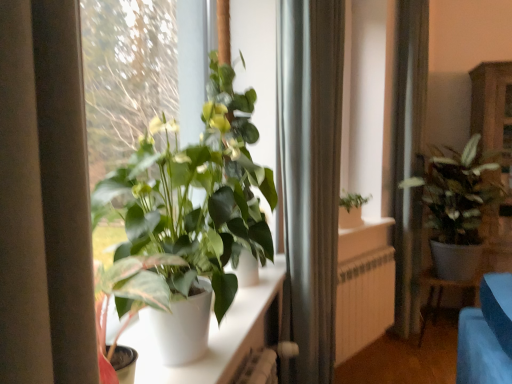
Where is `textured green plant at right, which is counted as the second houseplant, starting from the front`? This screenshot has height=384, width=512. textured green plant at right, which is counted as the second houseplant, starting from the front is located at coordinates (458, 205).

Where is `dresser above the white glossy plant at center (from a real-world perspective)`? Image resolution: width=512 pixels, height=384 pixels. dresser above the white glossy plant at center (from a real-world perspective) is located at coordinates (492, 104).

Is point (471, 109) farther from viewer compared to point (223, 368)?

Yes, point (471, 109) is farther from viewer.

From a real-world perspective, between wooden cabinet at right and white glossy plant at center, who is vertically higher?

wooden cabinet at right, from a real-world perspective.

Is silky white curtain at center, the second curtain positioned from the right, not close to silky white curtain at right, marked as the second curtain in a front-to-back arrangement?

Yes.

Considering the relative sizes of silky white curtain at center, the 1th curtain from the left, and silky white curtain at right, which appears as the 1th curtain when viewed from the right, in the image provided, is silky white curtain at center, the 1th curtain from the left, smaller than silky white curtain at right, which appears as the 1th curtain when viewed from the right,?

Yes, silky white curtain at center, the 1th curtain from the left, is smaller than silky white curtain at right, which appears as the 1th curtain when viewed from the right.

Could you tell me if silky white curtain at center, marked as the 2th curtain in a back-to-front arrangement, is facing silky white curtain at right, marked as the first curtain in a back-to-front arrangement?

No, silky white curtain at center, marked as the 2th curtain in a back-to-front arrangement, is not aimed at silky white curtain at right, marked as the first curtain in a back-to-front arrangement.

The height and width of the screenshot is (384, 512). Find the location of `curtain located below the silky white curtain at right, which appears as the 1th curtain when viewed from the right (from the image's perspective)`. curtain located below the silky white curtain at right, which appears as the 1th curtain when viewed from the right (from the image's perspective) is located at coordinates (310, 178).

Does white glossy plant at center touch silky white curtain at center, the 1th curtain from the left?

white glossy plant at center and silky white curtain at center, the 1th curtain from the left, are clearly separated.

Is white glossy plant at center behind silky white curtain at center, marked as the 2th curtain in a back-to-front arrangement?

No.

Considering the sizes of objects white glossy plant at center and silky white curtain at center, marked as the 2th curtain in a back-to-front arrangement, in the image provided, who is wider, white glossy plant at center or silky white curtain at center, marked as the 2th curtain in a back-to-front arrangement,?

With larger width is silky white curtain at center, marked as the 2th curtain in a back-to-front arrangement.

Which object is positioned more to the left, silky white curtain at center, which appears as the 1th curtain when viewed from the front, or white matte radiator at center?

silky white curtain at center, which appears as the 1th curtain when viewed from the front, is more to the left.

From the image's perspective, is silky white curtain at center, marked as the 2th curtain in a back-to-front arrangement, above or below white matte radiator at center?

silky white curtain at center, marked as the 2th curtain in a back-to-front arrangement, is above white matte radiator at center.

I want to click on curtain in front of the white matte radiator at center, so click(x=310, y=178).

Can you confirm if silky white curtain at center, which appears as the 1th curtain when viewed from the front, is smaller than white matte radiator at center?

No, silky white curtain at center, which appears as the 1th curtain when viewed from the front, is not smaller than white matte radiator at center.

From the image's perspective, is white glossy plant at center above or below silky white curtain at right, the 2th curtain from the left?

white glossy plant at center is below silky white curtain at right, the 2th curtain from the left.

Which object is thinner, white glossy plant at center or silky white curtain at right, which appears as the 1th curtain when viewed from the right?

With smaller width is white glossy plant at center.

Consider the image. Is white glossy plant at center next to silky white curtain at right, which appears as the 1th curtain when viewed from the right, and touching it?

No, white glossy plant at center is not making contact with silky white curtain at right, which appears as the 1th curtain when viewed from the right.

Is white glossy plant at center positioned with its back to silky white curtain at right, marked as the second curtain in a front-to-back arrangement?

white glossy plant at center is not turned away from silky white curtain at right, marked as the second curtain in a front-to-back arrangement.

Could you tell me if green matte plant at center, marked as the first houseplant in a left-to-right arrangement, is facing white matte radiator at center?

No, green matte plant at center, marked as the first houseplant in a left-to-right arrangement, is not facing towards white matte radiator at center.

I want to click on radiator lying behind the green matte plant at center, the 2th houseplant in the back-to-front sequence, so [364, 301].

From the image's perspective, does green matte plant at center, the 2th houseplant in the back-to-front sequence, appear higher than white matte radiator at center?

Correct, green matte plant at center, the 2th houseplant in the back-to-front sequence, appears higher than white matte radiator at center in the image.

Is silky white curtain at right, which appears as the 1th curtain when viewed from the right, not near white matte radiator at center?

That's not correct — silky white curtain at right, which appears as the 1th curtain when viewed from the right, is a little close to white matte radiator at center.

Is silky white curtain at right, the 2th curtain from the left, aimed at white matte radiator at center?

No, silky white curtain at right, the 2th curtain from the left, is not aimed at white matte radiator at center.

Which object is wider, silky white curtain at right, which appears as the 1th curtain when viewed from the right, or white matte radiator at center?

silky white curtain at right, which appears as the 1th curtain when viewed from the right.

Considering the sizes of objects silky white curtain at right, marked as the second curtain in a front-to-back arrangement, and white matte radiator at center in the image provided, who is bigger, silky white curtain at right, marked as the second curtain in a front-to-back arrangement, or white matte radiator at center?

silky white curtain at right, marked as the second curtain in a front-to-back arrangement.

The image size is (512, 384). Find the location of `window on the left side of wooden cabinet at right`. window on the left side of wooden cabinet at right is located at coordinates (219, 335).

You are a GUI agent. You are given a task and a screenshot of the screen. Output one action in this format:
    pyautogui.click(x=<x>, y=<y>)
    Task: Click on the curtain behind the silky white curtain at center, the second curtain positioned from the right
    
    Given the screenshot: What is the action you would take?
    pos(409,158)

From the image, which object appears to be nearer to white glossy plant at center, silky white curtain at right, the 2th curtain from the left, or textured green plant at right, positioned as the 2th houseplant in left-to-right order?

textured green plant at right, positioned as the 2th houseplant in left-to-right order, is positioned closer to the anchor white glossy plant at center.

Estimate the real-world distances between objects in this image. Which object is further from white glossy plant at center, silky white curtain at right, marked as the second curtain in a front-to-back arrangement, or wooden cabinet at right?

wooden cabinet at right lies further to white glossy plant at center than the other object.

When comparing their distances from silky white curtain at center, which appears as the 1th curtain when viewed from the front, does white matte radiator at center or green matte plant at center, the 2th houseplant in the back-to-front sequence, seem closer?

green matte plant at center, the 2th houseplant in the back-to-front sequence.

Based on the photo, looking at the image, which one is located further to green matte plant at center, the 2th houseplant in the back-to-front sequence, white glossy plant at center or white matte radiator at center?

Among the two, white matte radiator at center is located further to green matte plant at center, the 2th houseplant in the back-to-front sequence.

From the image, which object appears to be farther from silky white curtain at center, marked as the 2th curtain in a back-to-front arrangement, white matte radiator at center or silky white curtain at right, marked as the first curtain in a back-to-front arrangement?

Based on the image, silky white curtain at right, marked as the first curtain in a back-to-front arrangement, appears to be further to silky white curtain at center, marked as the 2th curtain in a back-to-front arrangement.

Which object lies nearer to the anchor point textured green plant at right, which is counted as the second houseplant, starting from the front, white glossy plant at center or silky white curtain at center, the second curtain positioned from the right?

silky white curtain at center, the second curtain positioned from the right.

Estimate the real-world distances between objects in this image. Which object is closer to silky white curtain at right, the 2th curtain from the left, white glossy plant at center or white matte radiator at center?

Among the two, white matte radiator at center is located nearer to silky white curtain at right, the 2th curtain from the left.

Looking at the image, which one is located further to green matte plant at center, the first houseplant in the front-to-back sequence, silky white curtain at right, which appears as the 1th curtain when viewed from the right, or textured green plant at right, the first houseplant in the back-to-front sequence?

silky white curtain at right, which appears as the 1th curtain when viewed from the right.

The image size is (512, 384). In order to click on curtain between silky white curtain at center, marked as the 2th curtain in a back-to-front arrangement, and wooden cabinet at right in this screenshot , I will do `click(409, 158)`.

The height and width of the screenshot is (384, 512). What are the coordinates of `curtain located between white glossy plant at center and silky white curtain at right, the 2th curtain from the left, in the depth direction` in the screenshot? It's located at (310, 178).

Find the location of a particular element. window between green matte plant at center, the first houseplant in the front-to-back sequence, and white matte radiator at center, along the z-axis is located at coordinates (219, 335).

At what (x,y) coordinates should I click in order to perform the action: click on curtain between green matte plant at center, marked as the first houseplant in a left-to-right arrangement, and textured green plant at right, which is counted as the second houseplant, starting from the front, from front to back. Please return your answer as a coordinate pair (x, y). This screenshot has width=512, height=384. Looking at the image, I should click on (310, 178).